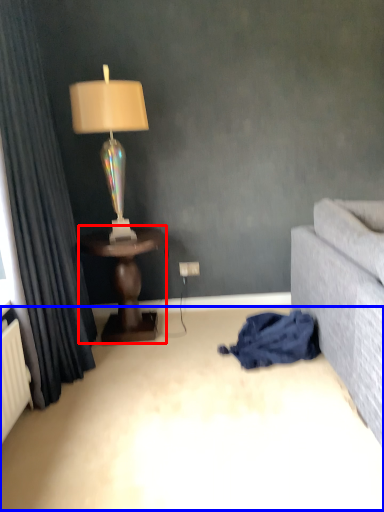
Question: Which object appears farthest to the camera in this image, table (highlighted by a red box) or plain (highlighted by a blue box)?

Choices:
 (A) table
 (B) plain

Answer: (A)